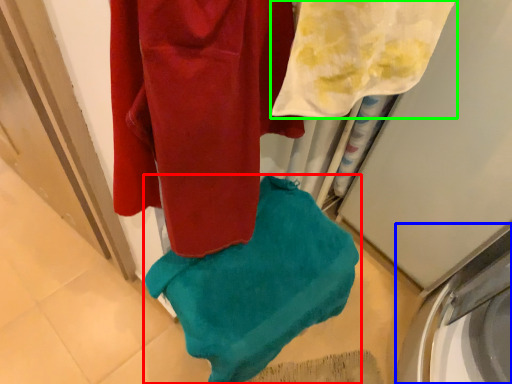
Question: Considering the real-world distances, which object is closest to towel (highlighted by a red box)? washing machine (highlighted by a blue box) or towel (highlighted by a green box).

Choices:
 (A) washing machine
 (B) towel

Answer: (B)